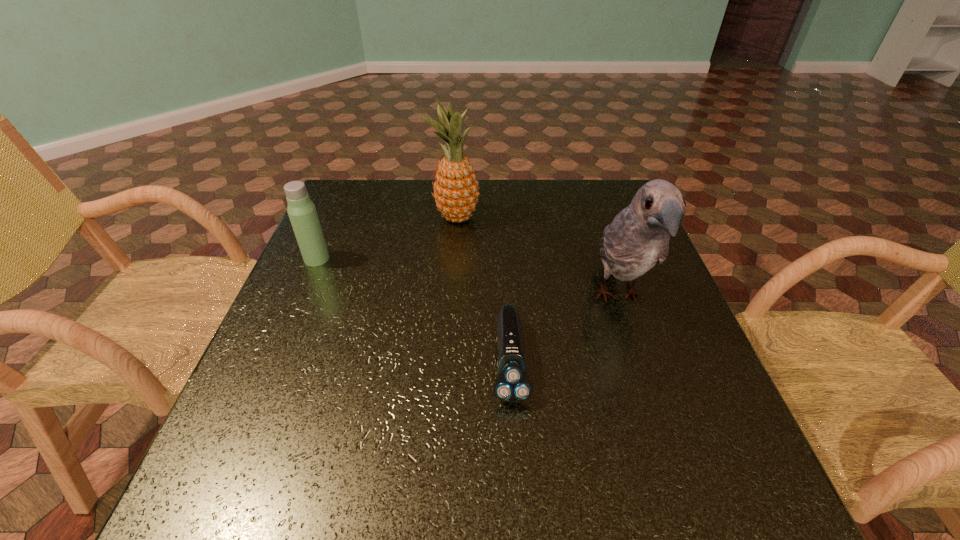
Identify the location of free spot between the leftmost object and the second object from right to left. (413, 310).

You are a GUI agent. You are given a task and a screenshot of the screen. Output one action in this format:
    pyautogui.click(x=<x>, y=<y>)
    Task: Click on the vacant region between the shortest object and the third object from right to left
    
    Given the screenshot: What is the action you would take?
    pyautogui.click(x=483, y=289)

Identify the location of free space between the thermos bottle and the second object from right to left. This screenshot has width=960, height=540. (413, 310).

Identify the location of free spot between the pineapple and the second object from right to left. (483, 289).

The image size is (960, 540). Identify the location of vacant space that is in between the farthest object and the third object from left to right. (483, 289).

The height and width of the screenshot is (540, 960). I want to click on vacant area that lies between the third object from left to right and the rightmost object, so click(x=564, y=329).

Locate an element on the screen. This screenshot has width=960, height=540. vacant space that's between the shortest object and the leftmost object is located at coordinates (413, 310).

Where is `free space between the electric shaver and the farthest object`? free space between the electric shaver and the farthest object is located at coordinates (483, 289).

Locate an element on the screen. empty space between the leftmost object and the third object from left to right is located at coordinates (413, 310).

Image resolution: width=960 pixels, height=540 pixels. I want to click on object that stands as the second closest to the pineapple, so click(x=638, y=238).